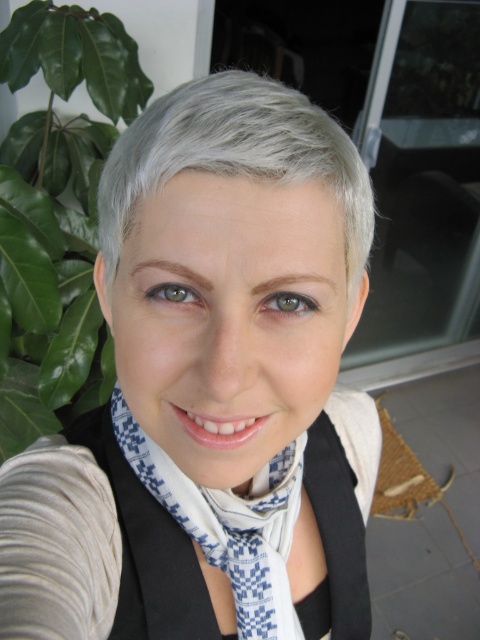
You are a photographer adjusting the lighting for a portrait. You notice the white matte scarf at center and the gray matte hair at upper center. Which object should you focus on to ensure the reflection from the window is properly captured?

The white matte scarf at center is in front of the gray matte hair at upper center, so focusing on the white matte scarf at center would ensure the reflection from the window is properly captured as it is closer to the camera.

You are a photographer adjusting the focus on your camera. You need to ensure both the gray matte hair at upper center and the white checkered scarf at center are in focus. Given that your camera can focus on objects within a 5 inch range, can both objects be in focus simultaneously?

The gray matte hair at upper center is 8.84 inches from the white checkered scarf at center. Since the distance between them exceeds the camera focus range of 5 inches, both objects cannot be in focus at the same time.